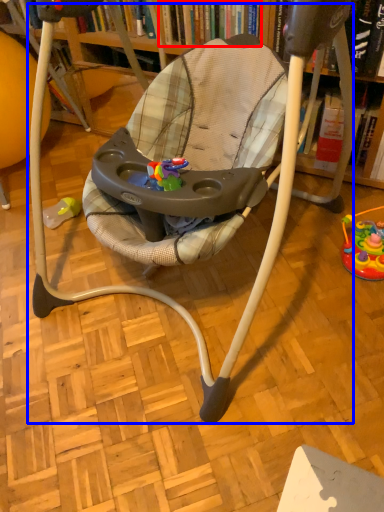
Question: Among these objects, which one is nearest to the camera, book (highlighted by a red box) or baby carriage (highlighted by a blue box)?

Choices:
 (A) book
 (B) baby carriage

Answer: (B)